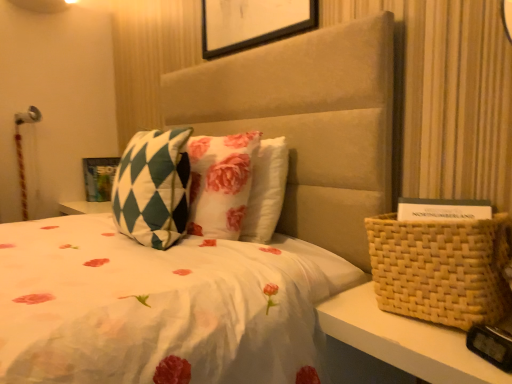
Question: From a real-world perspective, is matte green and white checkered picture frame at upper left under woven beige basket at right?

Choices:
 (A) no
 (B) yes

Answer: (A)

Question: Is matte green and white checkered picture frame at upper left wider than woven beige basket at right?

Choices:
 (A) no
 (B) yes

Answer: (A)

Question: Does matte green and white checkered picture frame at upper left appear on the right side of woven beige basket at right?

Choices:
 (A) no
 (B) yes

Answer: (A)

Question: Is matte green and white checkered picture frame at upper left touching woven beige basket at right?

Choices:
 (A) no
 (B) yes

Answer: (A)

Question: Does matte green and white checkered picture frame at upper left turn towards woven beige basket at right?

Choices:
 (A) no
 (B) yes

Answer: (A)

Question: Does matte green and white checkered picture frame at upper left appear on the left side of woven beige basket at right?

Choices:
 (A) no
 (B) yes

Answer: (B)

Question: From the image's perspective, is green checkered pillow at center located beneath matte green and white checkered picture frame at upper left?

Choices:
 (A) no
 (B) yes

Answer: (B)

Question: Can you confirm if green checkered pillow at center is taller than matte green and white checkered picture frame at upper left?

Choices:
 (A) no
 (B) yes

Answer: (B)

Question: Is green checkered pillow at center with matte green and white checkered picture frame at upper left?

Choices:
 (A) no
 (B) yes

Answer: (A)

Question: Can you confirm if green checkered pillow at center is thinner than matte green and white checkered picture frame at upper left?

Choices:
 (A) no
 (B) yes

Answer: (B)

Question: Is matte green and white checkered picture frame at upper left located within green checkered pillow at center?

Choices:
 (A) no
 (B) yes

Answer: (A)

Question: From the image's perspective, does green checkered pillow at center appear higher than matte green and white checkered picture frame at upper left?

Choices:
 (A) yes
 (B) no

Answer: (B)

Question: From a real-world perspective, does matte green and white checkered picture frame at upper left sit lower than green checkered pillow at center?

Choices:
 (A) yes
 (B) no

Answer: (A)